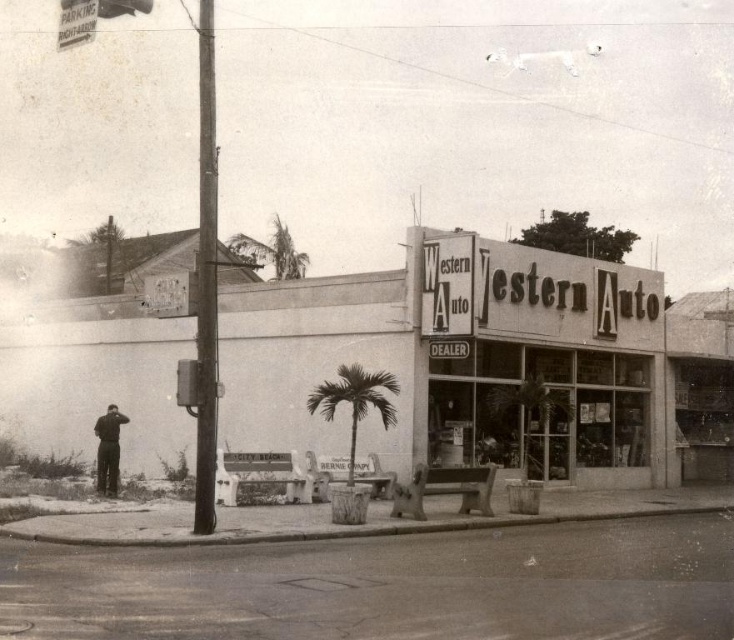
Question: Which point is farther to the camera?

Choices:
 (A) (109, 445)
 (B) (275, 224)

Answer: (B)

Question: Can you confirm if green leafy palm tree at center is positioned to the left of dark gray suit at left?

Choices:
 (A) no
 (B) yes

Answer: (A)

Question: Which object is farther from the camera taking this photo?

Choices:
 (A) green leafy palm tree at upper center
 (B) green leafy palm tree at center
 (C) white concrete western auto at center
 (D) dark gray suit at left

Answer: (A)

Question: Is white concrete western auto at center wider than green leafy palm tree at upper center?

Choices:
 (A) no
 (B) yes

Answer: (A)

Question: Considering the relative positions of white concrete western auto at center and green leafy palm tree at center in the image provided, where is white concrete western auto at center located with respect to green leafy palm tree at center?

Choices:
 (A) right
 (B) left

Answer: (A)

Question: Which of the following is the closest to the observer?

Choices:
 (A) green leafy palm tree at upper center
 (B) green leafy palm tree at center

Answer: (B)